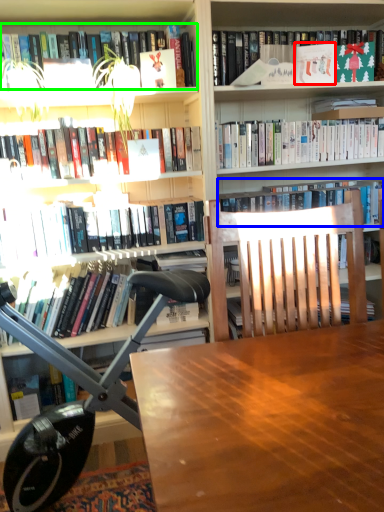
Question: Which object is the closest to the paperback book (highlighted by a red box)? Choose among these: book (highlighted by a blue box) or book (highlighted by a green box).

Choices:
 (A) book
 (B) book

Answer: (A)